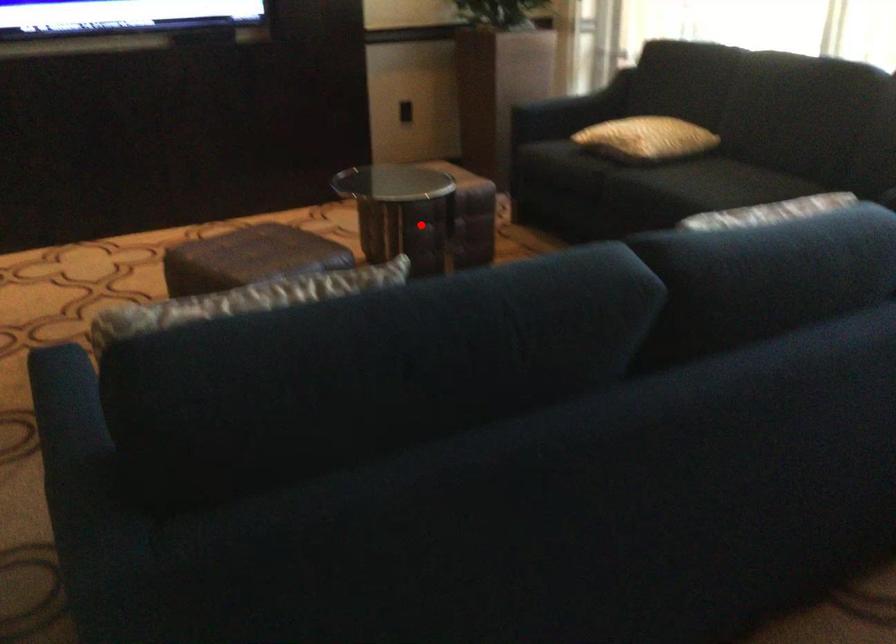
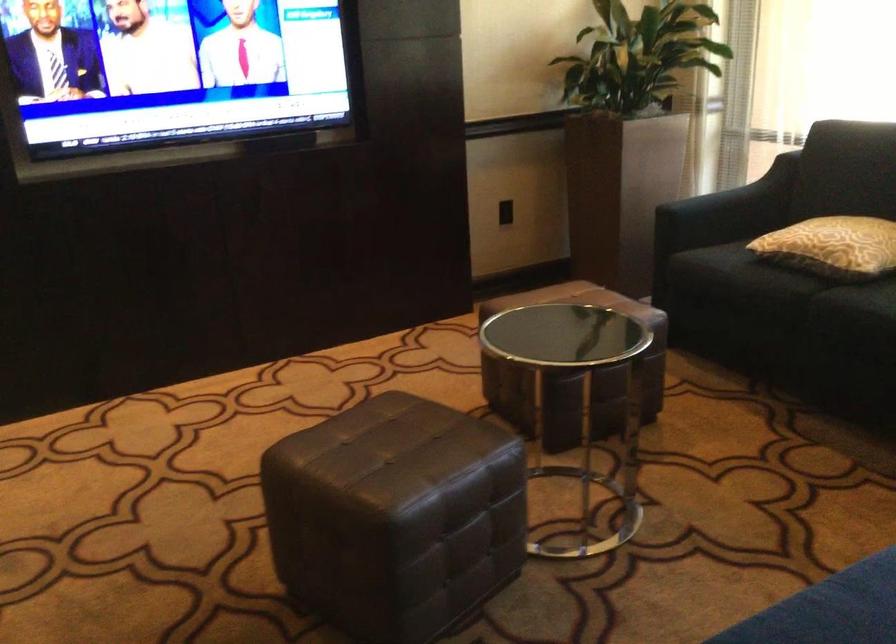
Question: I am providing you with two images of the same scene from different viewpoints. Given a red point in image1, look at the same physical point in image2. Is it:

Choices:
 (A) Closer to the viewpoint
 (B) Farther from the viewpoint

Answer: (A)